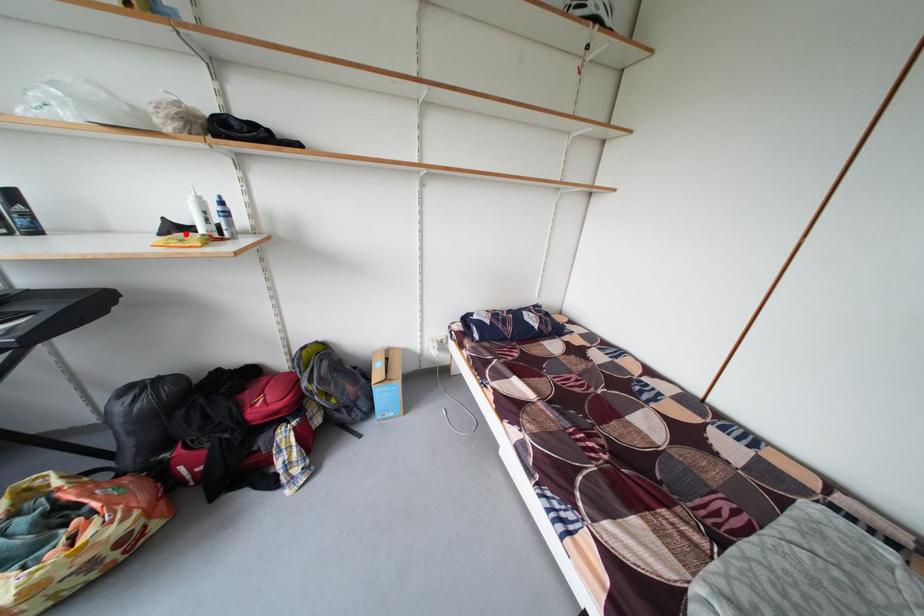
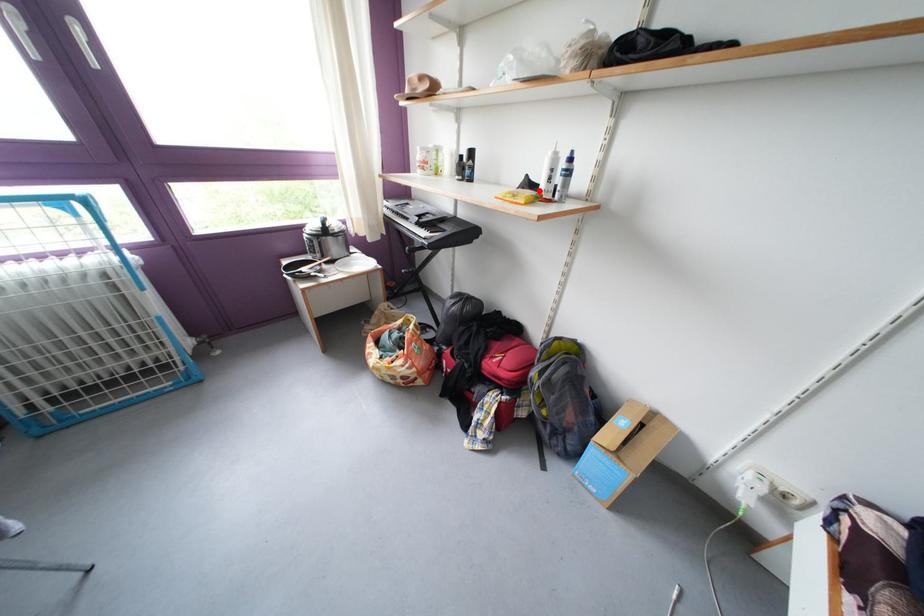
I am providing you with two images of the same scene from different viewpoints. A red point is marked on the first image and another point is marked on the second image. Does the point marked in image1 correspond to the same location as the one in image2?

Yes